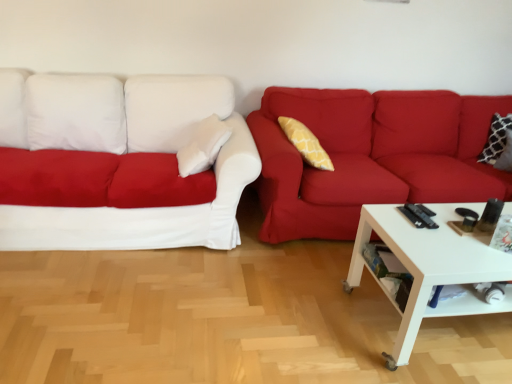
Question: In terms of size, does white fabric couch at left, the first studio couch when ordered from left to right, appear bigger or smaller than matte red couch at right, which is counted as the second studio couch, starting from the left?

Choices:
 (A) small
 (B) big

Answer: (B)

Question: Does point (170, 120) appear closer or farther from the camera than point (463, 120)?

Choices:
 (A) farther
 (B) closer

Answer: (B)

Question: Estimate the real-world distances between objects in this image. Which object is closer to the white glossy coffee table at lower right?

Choices:
 (A) white fabric couch at left, the first studio couch when ordered from left to right
 (B) matte red couch at right, placed as the 1th studio couch when sorted from right to left

Answer: (B)

Question: Which object is positioned closest to the white fabric couch at left, the first studio couch when ordered from left to right?

Choices:
 (A) matte red couch at right, which is counted as the second studio couch, starting from the left
 (B) white glossy coffee table at lower right

Answer: (A)